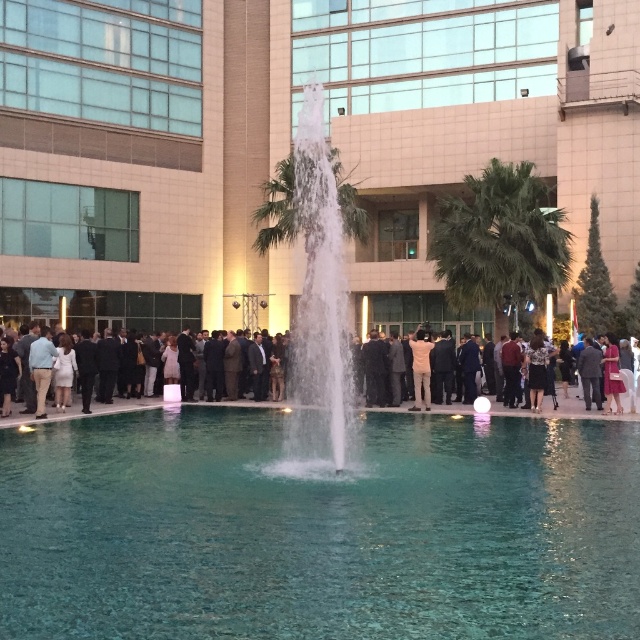
Consider the image. Is transparent glass mall at center above formal attire group at center?

Correct, transparent glass mall at center is located above formal attire group at center.

The width and height of the screenshot is (640, 640). What do you see at coordinates (289, 145) in the screenshot?
I see `transparent glass mall at center` at bounding box center [289, 145].

This screenshot has width=640, height=640. In order to click on transparent glass mall at center in this screenshot , I will do `click(289, 145)`.

Does transparent glass mall at center have a greater width compared to clear glass pool at center?

Correct, the width of transparent glass mall at center exceeds that of clear glass pool at center.

Is transparent glass mall at center above clear glass pool at center?

Indeed, transparent glass mall at center is positioned over clear glass pool at center.

Identify the location of transparent glass mall at center. (289, 145).

Between transparent glass mall at center and white matte shirt at center, which one is positioned lower?

white matte shirt at center is lower down.

Does transparent glass mall at center have a smaller size compared to white matte shirt at center?

No, transparent glass mall at center is not smaller than white matte shirt at center.

Is point (417, 138) behind point (417, 388)?

Yes, it is behind point (417, 388).

Identify the location of transparent glass mall at center. Image resolution: width=640 pixels, height=640 pixels. (289, 145).